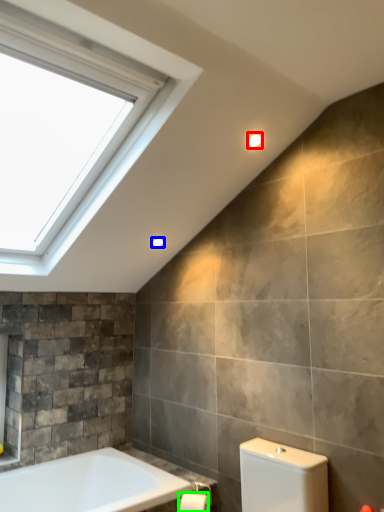
Question: Which object is the farthest from light fixture (highlighted by a red box)? Choose among these: light fixture (highlighted by a blue box) or toilet paper (highlighted by a green box).

Choices:
 (A) light fixture
 (B) toilet paper

Answer: (B)